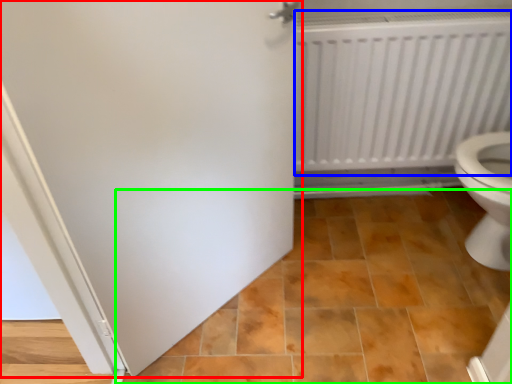
Question: Considering the real-world distances, which object is closest to door (highlighted by a red box)? radiator (highlighted by a blue box) or ceramic tile (highlighted by a green box).

Choices:
 (A) radiator
 (B) ceramic tile

Answer: (B)